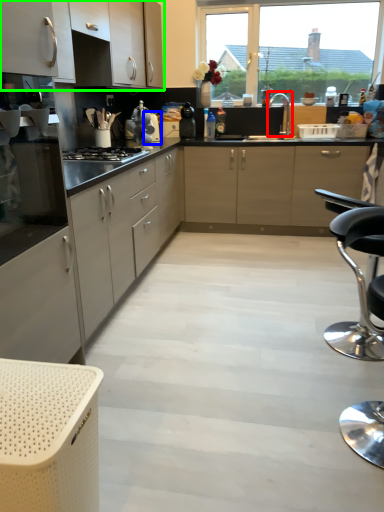
Question: Considering the real-world distances, which object is farthest from tap (highlighted by a red box)? appliance (highlighted by a blue box) or cabinetry (highlighted by a green box)?

Choices:
 (A) appliance
 (B) cabinetry

Answer: (B)